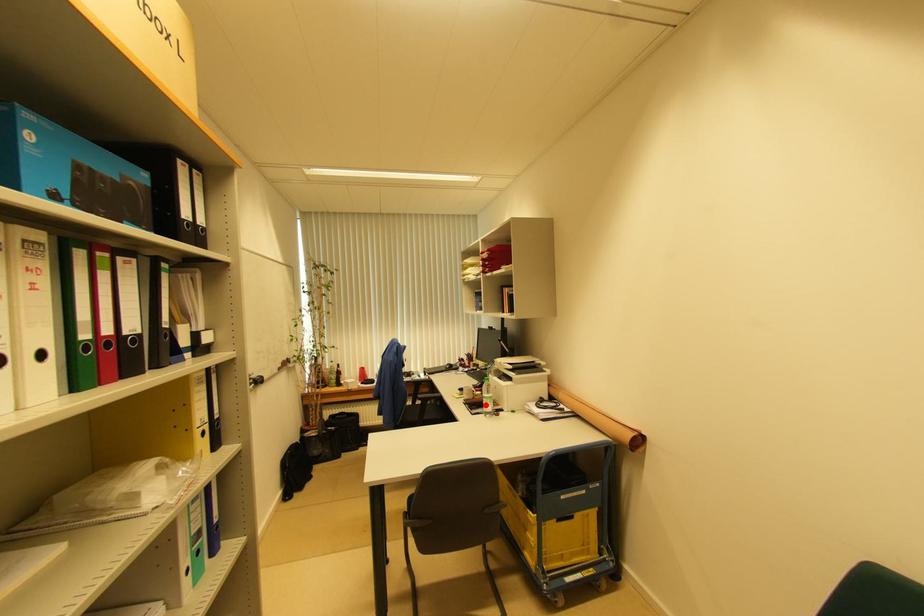
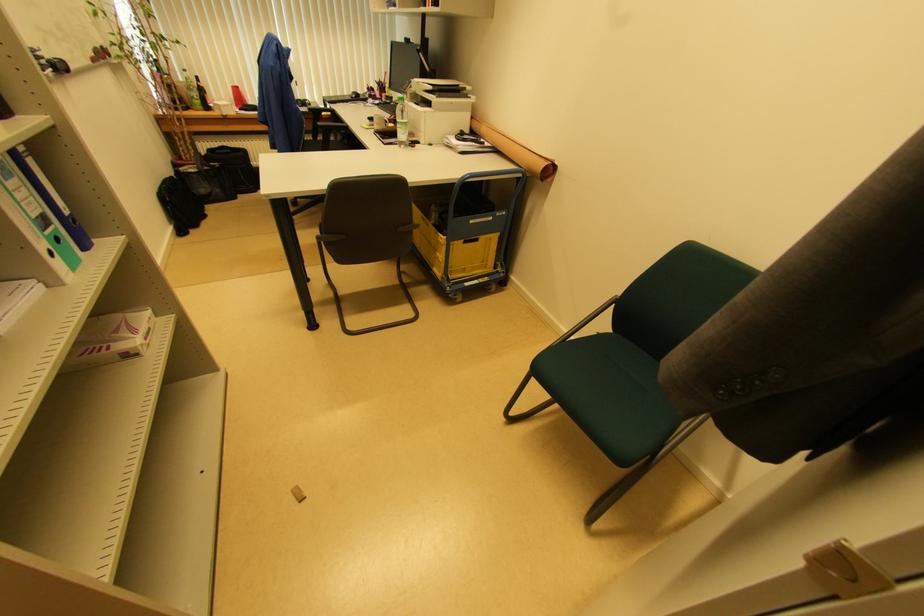
Where in the second image is the point corresponding to the highlighted location from the first image?

(398, 132)